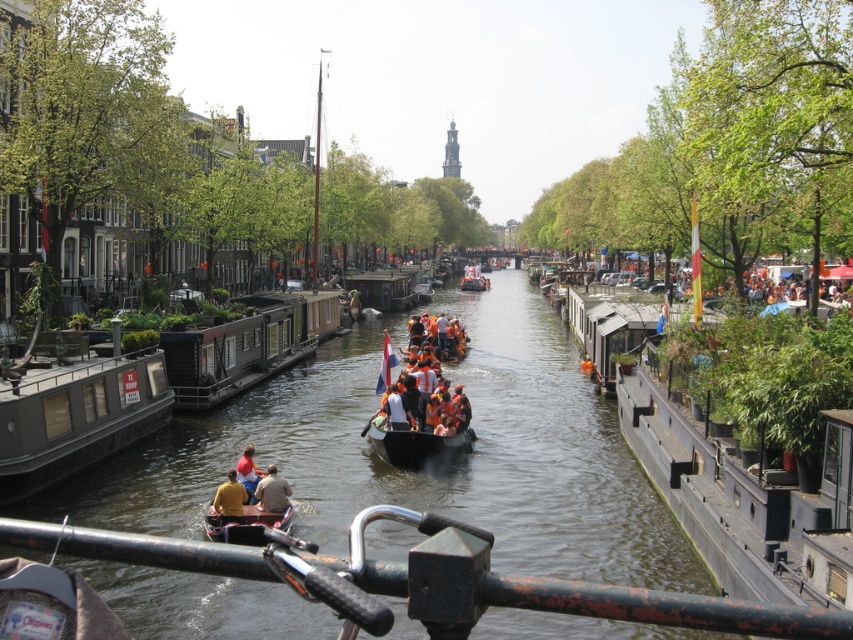
Can you confirm if rusty metal rail at lower center is thinner than brown leather jacket at center?

In fact, rusty metal rail at lower center might be wider than brown leather jacket at center.

In the scene shown: Does rusty metal rail at lower center have a larger size compared to brown leather jacket at center?

Yes.

Measure the distance between point (225, 566) and camera.

Point (225, 566) is 11.15 meters from camera.

Where is `rusty metal rail at lower center`? The width and height of the screenshot is (853, 640). rusty metal rail at lower center is located at coordinates (432, 580).

Who is positioned more to the left, yellow fabric at lower center or brown leather jacket at center?

From the viewer's perspective, yellow fabric at lower center appears more on the left side.

Does yellow fabric at lower center have a greater width compared to brown leather jacket at center?

Indeed, yellow fabric at lower center has a greater width compared to brown leather jacket at center.

Identify the location of yellow fabric at lower center. (230, 499).

Where is `yellow fabric at lower center`? The height and width of the screenshot is (640, 853). yellow fabric at lower center is located at coordinates (230, 499).

Which is behind, point (143, 355) or point (410, 276)?

Point (410, 276)

Does dark gray matte houseboat at left have a lesser width compared to wooden boat at center?

Correct, dark gray matte houseboat at left's width is less than wooden boat at center's.

What do you see at coordinates (76, 417) in the screenshot? The width and height of the screenshot is (853, 640). I see `dark gray matte houseboat at left` at bounding box center [76, 417].

Where is `dark gray matte houseboat at left`? This screenshot has width=853, height=640. dark gray matte houseboat at left is located at coordinates (76, 417).